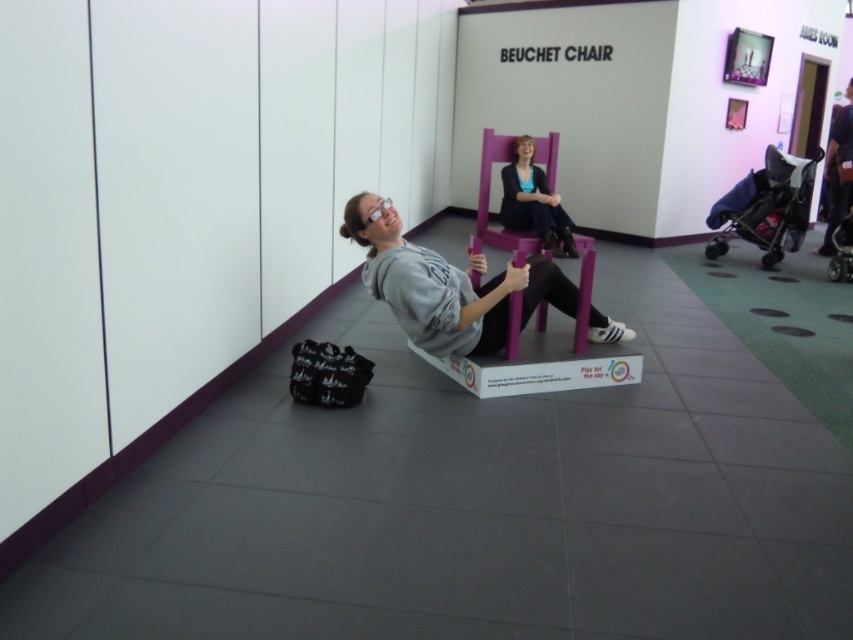
Who is positioned more to the left, matte gray hoodie at center or dark gray fabric pants at right?

matte gray hoodie at center

Where is `matte gray hoodie at center`? This screenshot has height=640, width=853. matte gray hoodie at center is located at coordinates (445, 285).

Identify the location of matte gray hoodie at center. The width and height of the screenshot is (853, 640). (445, 285).

Consider the image. Is matte purple chair at center bigger than dark gray fabric pants at right?

Actually, matte purple chair at center might be smaller than dark gray fabric pants at right.

Between matte purple chair at center and dark gray fabric pants at right, which one is positioned higher?

dark gray fabric pants at right is higher up.

Is point (564, 241) behind point (850, 150)?

No, it is in front of (850, 150).

Locate an element on the screen. matte purple chair at center is located at coordinates (532, 202).

Does purple matte chair at center have a lesser width compared to dark gray fabric pants at right?

Incorrect, purple matte chair at center's width is not less than dark gray fabric pants at right's.

Between purple matte chair at center and dark gray fabric pants at right, which one has less height?

With less height is purple matte chair at center.

Who is more distant from viewer, (512, 232) or (827, 176)?

The point (827, 176) is more distant.

Where is `purple matte chair at center`? The width and height of the screenshot is (853, 640). purple matte chair at center is located at coordinates (488, 202).